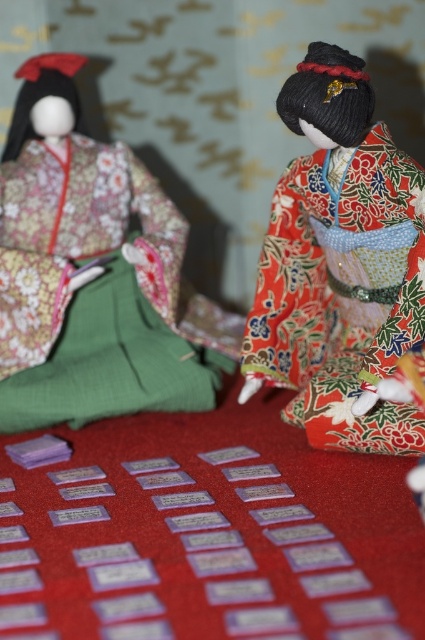
You are a museum curator arranging an exhibition of Hina dolls. You have two dolls in front of you, the matte floral kimono at left and the shiny red kimono doll at center. Which doll requires more horizontal space to display properly?

The matte floral kimono at left requires more horizontal space to display properly because its width is larger than the shiny red kimono doll at center.

In the scene shown: You are a visitor at a traditional Japanese exhibition and see the two dolls. Which doll, the matte floral kimono at left or the shiny red kimono doll at center, is closer to you?

The matte floral kimono at left is closer to you because it is positioned further to the viewer than the shiny red kimono doll at center.

Looking at this image, you are arranging Hina dolls for a festival and need to place a new decorative item between the two dolls. Given their positions, where should you place the item to ensure it is between the matte floral kimono at left and the shiny red kimono doll at center?

Answer: The matte floral kimono at left is to the left of the shiny red kimono doll at center, so placing the decorative item between them would require positioning it to the right of the matte floral kimono at left and to the left of the shiny red kimono doll at center.